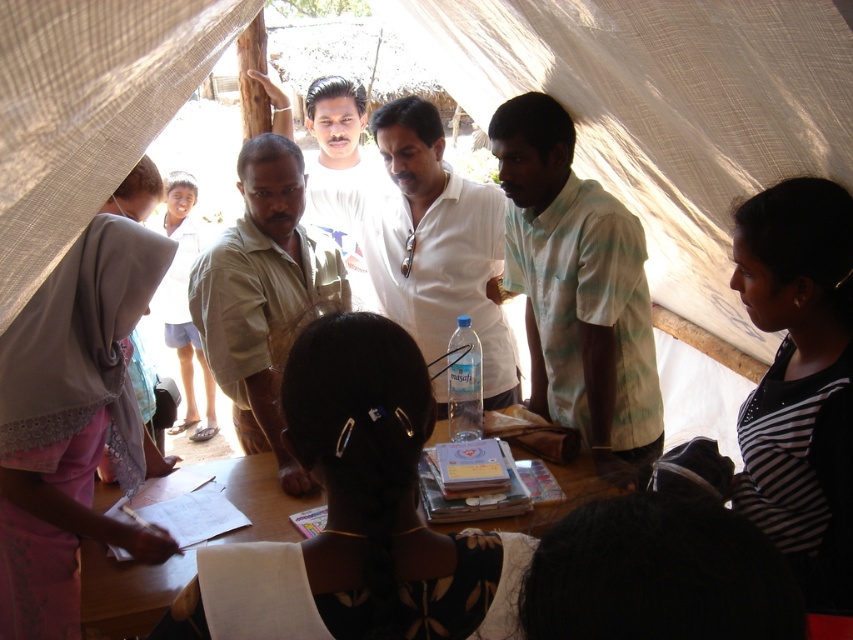
Question: Does green striped shirt at center appear over light beige shirt at center?

Choices:
 (A) yes
 (B) no

Answer: (A)

Question: Observing the image, what is the correct spatial positioning of white matte shirt at center in reference to wooden table at center?

Choices:
 (A) above
 (B) below

Answer: (A)

Question: Does wooden table at center have a smaller size compared to light brown skin at center?

Choices:
 (A) no
 (B) yes

Answer: (B)

Question: Which point is closer to the camera?

Choices:
 (A) (299, 250)
 (B) (517, 234)

Answer: (A)

Question: Which of the following is the farthest from the observer?

Choices:
 (A) light brown skin at center
 (B) light beige shirt at center
 (C) wooden table at center
 (D) green striped shirt at center

Answer: (A)

Question: Which point is closer to the camera?

Choices:
 (A) (281, 273)
 (B) (167, 342)
 (C) (102, 584)
 (D) (456, 179)

Answer: (C)